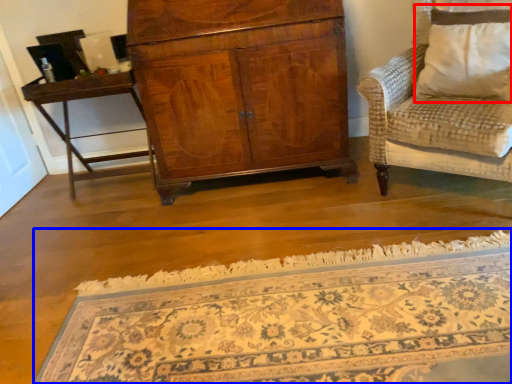
Question: Which of the following is the closest to the observer, pillow (highlighted by a red box) or mat (highlighted by a blue box)?

Choices:
 (A) pillow
 (B) mat

Answer: (B)